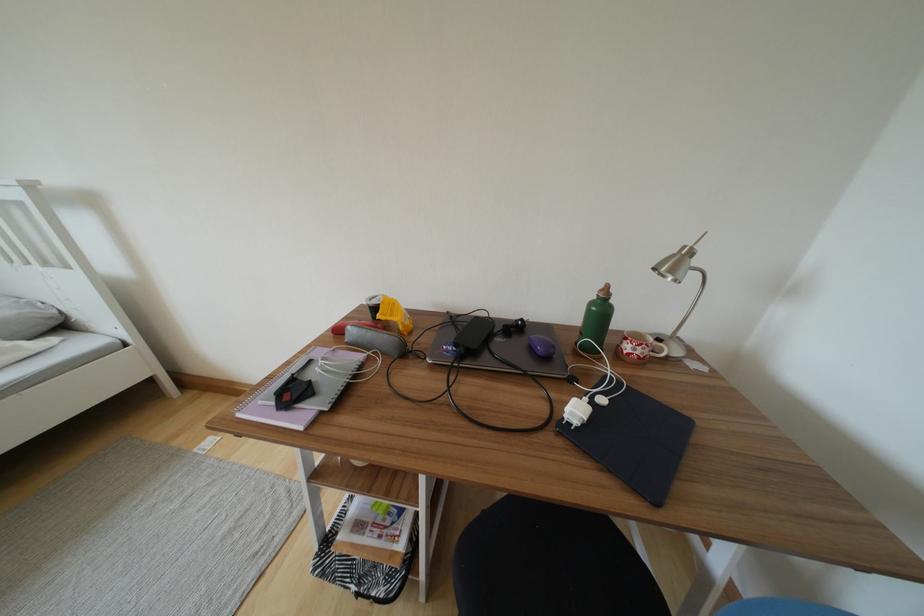
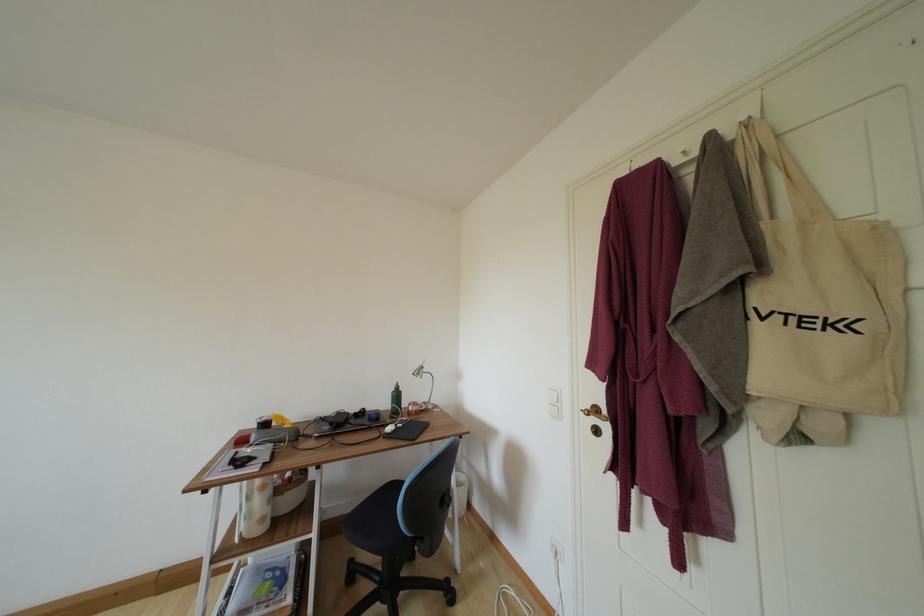
In the second image, find the point that corresponds to the point at 699,265 in the first image.

(430, 374)